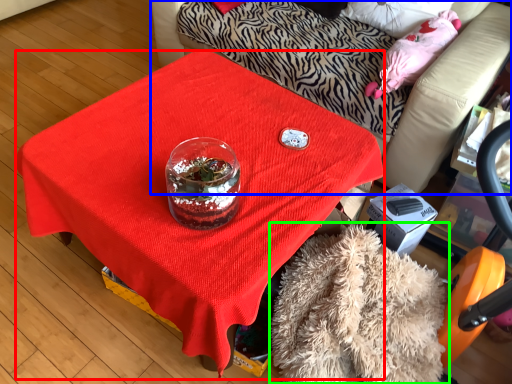
Question: Based on their relative distances, which object is nearer to desk (highlighted by a red box)? Choose from furniture (highlighted by a blue box) and blanket (highlighted by a green box).

Choices:
 (A) furniture
 (B) blanket

Answer: (B)